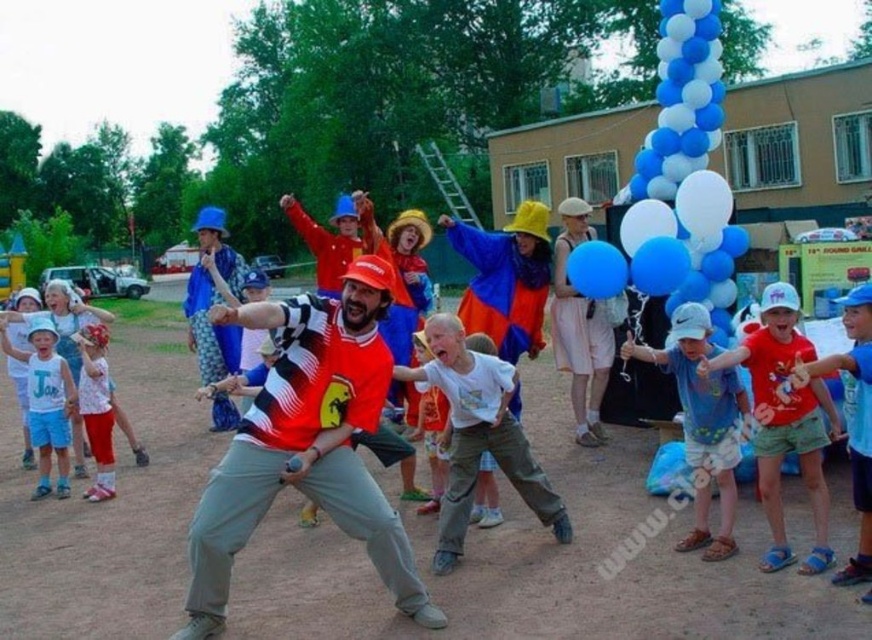
Can you confirm if blue cotton shorts at lower right is positioned to the right of matte white shirt at left?

Indeed, blue cotton shorts at lower right is positioned on the right side of matte white shirt at left.

Between point (869, 433) and point (76, 392), which one is positioned behind?

The point (76, 392) is behind.

This screenshot has width=872, height=640. What are the coordinates of `blue cotton shorts at lower right` in the screenshot? It's located at (853, 419).

Is white matte shirt at center wider than matte white shirt at lower left?

Yes, white matte shirt at center is wider than matte white shirt at lower left.

Describe the element at coordinates (478, 435) in the screenshot. I see `white matte shirt at center` at that location.

You are a GUI agent. You are given a task and a screenshot of the screen. Output one action in this format:
    pyautogui.click(x=<x>, y=<y>)
    Task: Click on the white matte shirt at center
    Image resolution: width=872 pixels, height=640 pixels.
    Given the screenshot: What is the action you would take?
    pyautogui.click(x=478, y=435)

Is red and black checkered shirt at center closer to camera compared to blue cotton shirt at center?

Yes.

Describe the element at coordinates (307, 444) in the screenshot. Image resolution: width=872 pixels, height=640 pixels. I see `red and black checkered shirt at center` at that location.

Between point (297, 442) and point (707, 538), which one is positioned behind?

The point (707, 538) is more distant.

The width and height of the screenshot is (872, 640). I want to click on red and black checkered shirt at center, so click(307, 444).